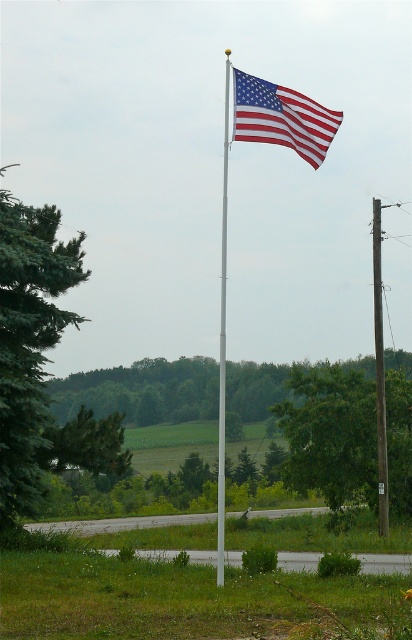
You are standing at the center of the image and want to walk towards the green coniferous tree at left. In which direction should you head?

The green coniferous tree at left is located at point 0.536 on the x and 0.070 on the y axis. Since you are at the center, you should head towards the left and slightly forward to reach it.

You are a photographer wanting to capture both the green coniferous tree at left and the smooth gray pole at center in your shot. Which object will appear bigger in the photo?

The green coniferous tree at left will appear bigger in the photo because it is larger in size than the smooth gray pole at center.